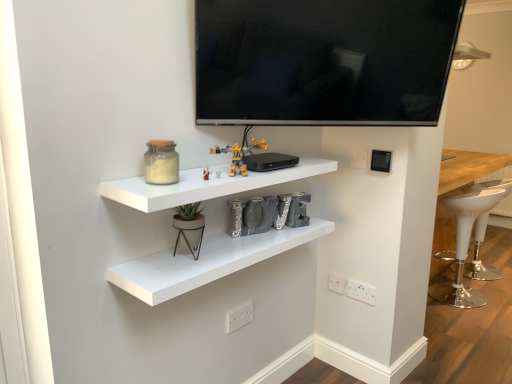
Find the location of `free space in front of metallic yellow toy at center, which is the 2th toy from bottom to top`. free space in front of metallic yellow toy at center, which is the 2th toy from bottom to top is located at coordinates (182, 181).